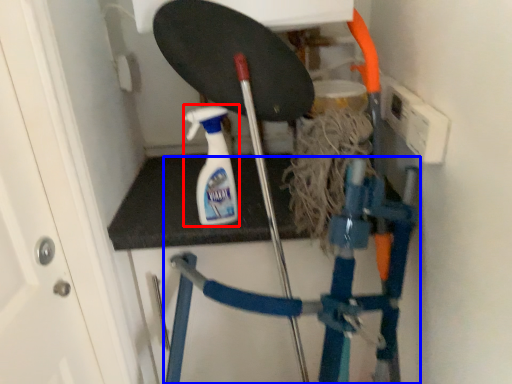
Question: Which point is further to the camera, cleaning product (highlighted by a red box) or ladder (highlighted by a blue box)?

Choices:
 (A) cleaning product
 (B) ladder

Answer: (B)